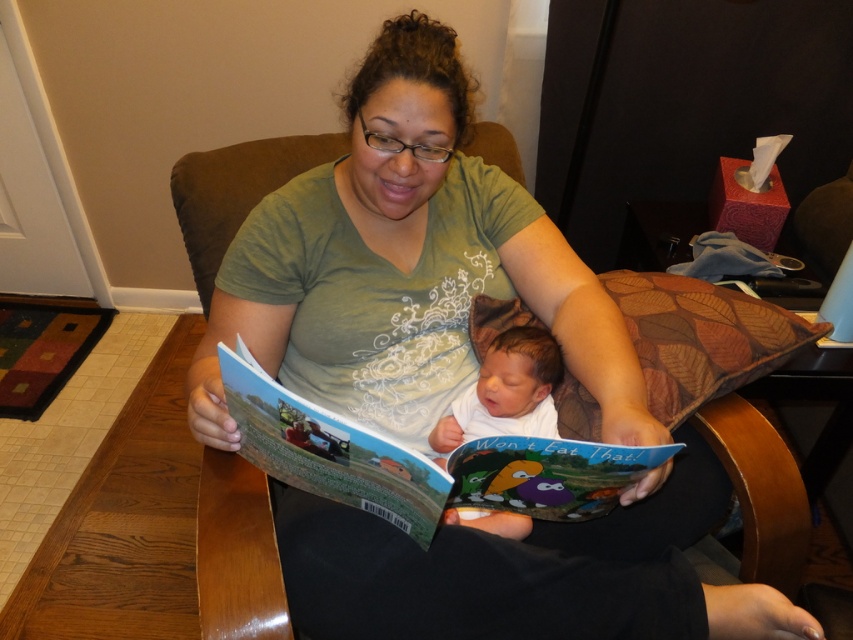
Question: Which object appears farthest from the camera in this image?

Choices:
 (A) hardcover book at center
 (B) soft white skin at center

Answer: (B)

Question: Does green matte shirt at center appear under hardcover book at center?

Choices:
 (A) no
 (B) yes

Answer: (A)

Question: Among these objects, which one is farthest from the camera?

Choices:
 (A) green matte shirt at center
 (B) hardcover book at center
 (C) soft white skin at center

Answer: (C)

Question: Does green matte shirt at center appear on the right side of hardcover book at center?

Choices:
 (A) yes
 (B) no

Answer: (A)

Question: Which object is closer to the camera taking this photo?

Choices:
 (A) green matte shirt at center
 (B) hardcover book at center
 (C) soft white skin at center

Answer: (B)

Question: Is green matte shirt at center positioned at the back of hardcover book at center?

Choices:
 (A) yes
 (B) no

Answer: (A)